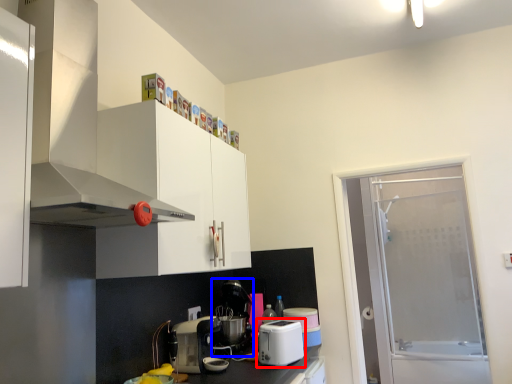
Question: Which point is closer to the camera, kitchen appliance (highlighted by a red box) or coffee machine (highlighted by a blue box)?

Choices:
 (A) kitchen appliance
 (B) coffee machine

Answer: (A)